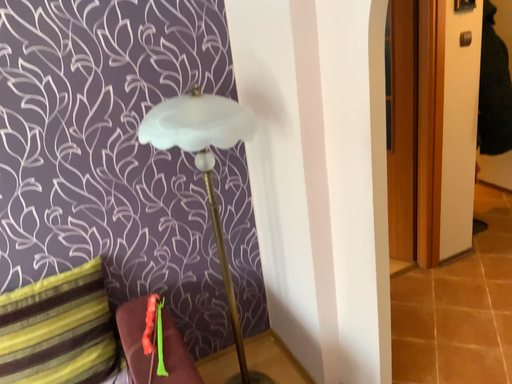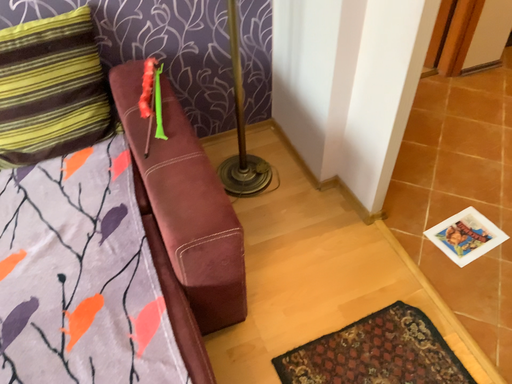
Question: Which way did the camera rotate in the video?

Choices:
 (A) rotated upward
 (B) rotated downward

Answer: (B)